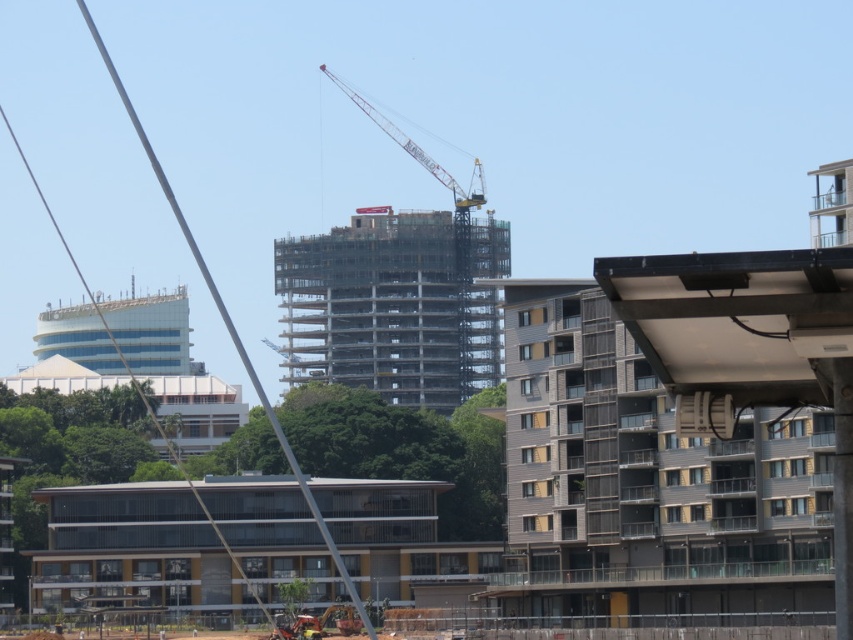
You are a construction worker standing at the origin point of the construction site. You need to locate the metal scaffolding at center. What are the coordinates where you can find it?

The metal scaffolding at center is located at coordinates point [393,305].

You are a construction worker who needs to move a heavy beam from the metal scaffolding at center to the metallic yellow crane at upper center. The beam is 15 meters long. Can you safely transport it horizontally between these two structures without bending or breaking the beam?

The distance between the metal scaffolding at center and the metallic yellow crane at upper center is 18.25 meters. Since the beam is only 15 meters long, there is a gap of 3.25 meters. This means the beam would not reach between the two structures, making it unsafe to transport horizontally without additional support or a longer beam.

You are an architect planning to install a new lighting system on the metal scaffolding at center and the metallic yellow crane at upper center. Based on the scene description, which object requires a taller ladder for installation?

The metal scaffolding at center requires a taller ladder because it is larger in size than the metallic yellow crane at upper center, indicating it might be positioned higher or have greater height.